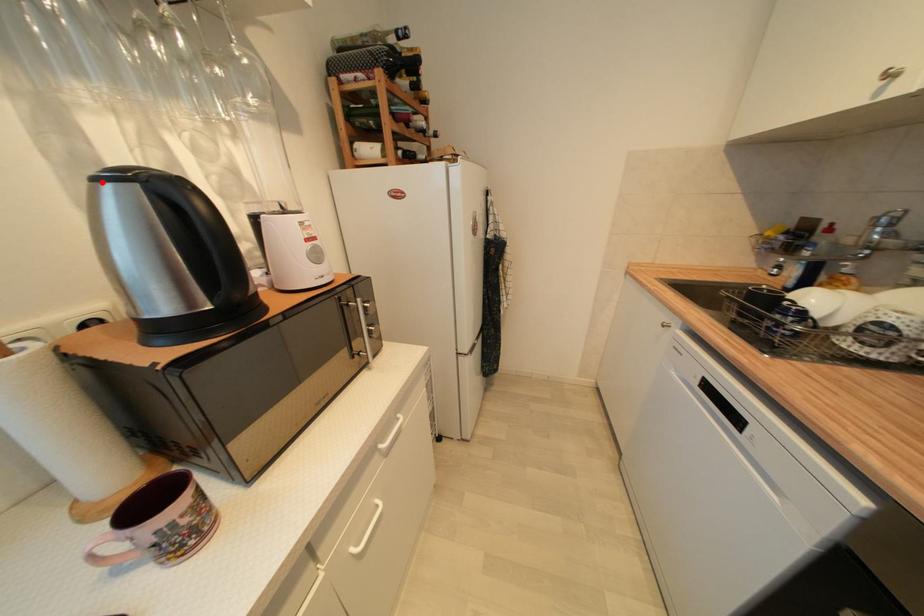
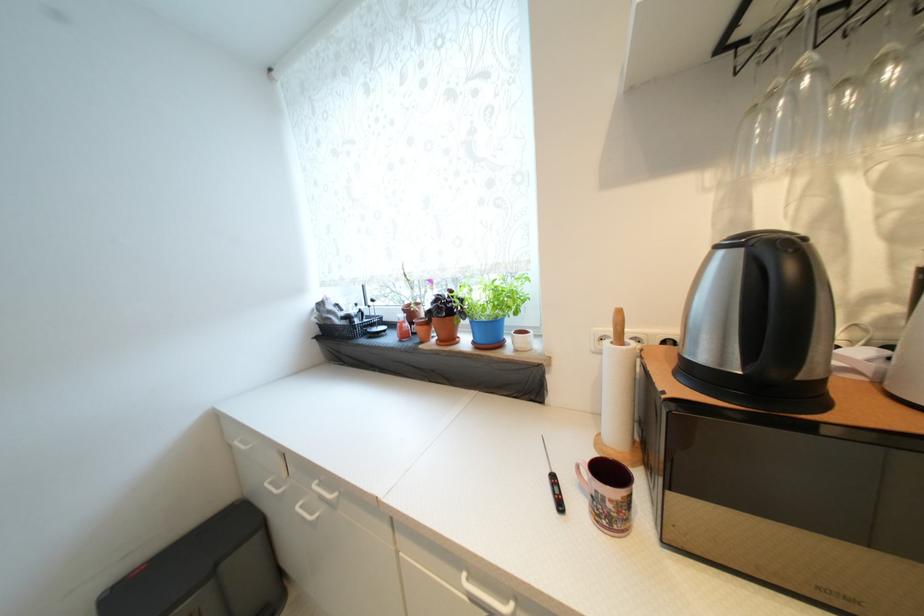
Find the pixel in the second image that matches the highlighted location in the first image.

(723, 249)